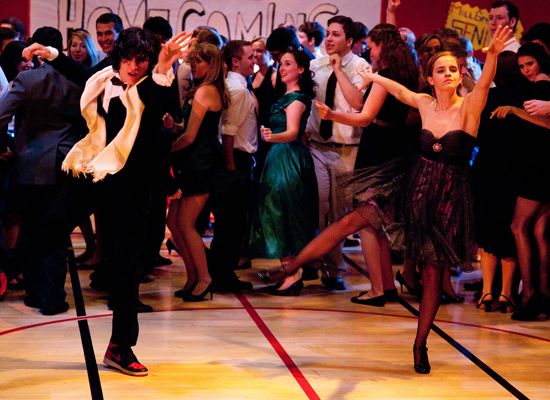
Image resolution: width=550 pixels, height=400 pixels. I want to click on shoes of female dancer in middle of floor, so click(x=265, y=280), click(x=423, y=373).